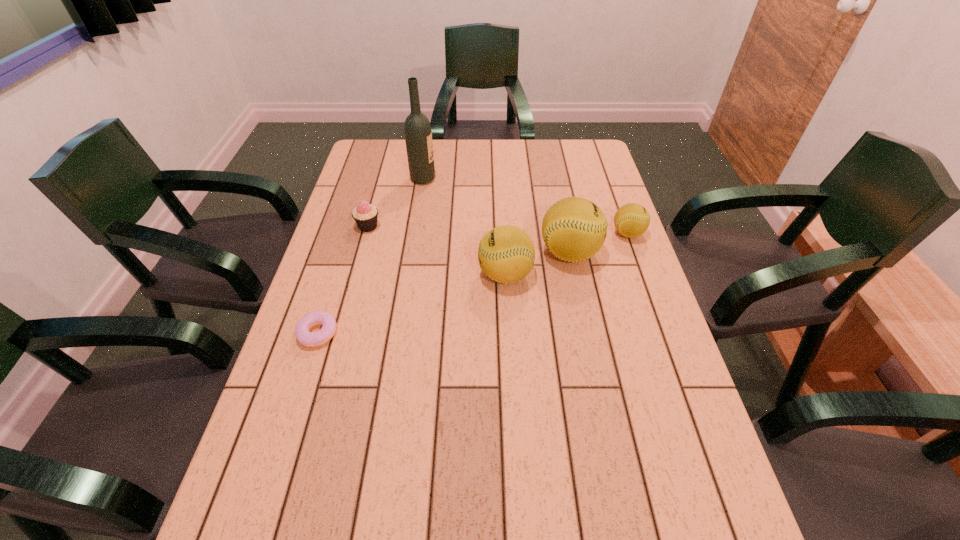
Identify the location of the second tallest softball. (506, 254).

Locate an element on the screen. the leftmost softball is located at coordinates (506, 254).

Locate an element on the screen. The image size is (960, 540). the second softball from right to left is located at coordinates (574, 229).

At what (x,y) coordinates should I click in order to perform the action: click on the rightmost softball. Please return your answer as a coordinate pair (x, y). This screenshot has height=540, width=960. Looking at the image, I should click on (631, 220).

Identify the location of the rightmost object. (631, 220).

Find the location of a particular element. The image size is (960, 540). the farthest object is located at coordinates (418, 136).

You are a GUI agent. You are given a task and a screenshot of the screen. Output one action in this format:
    pyautogui.click(x=<x>, y=<y>)
    Task: Click on the tallest object
    Image resolution: width=960 pixels, height=540 pixels.
    Given the screenshot: What is the action you would take?
    pyautogui.click(x=418, y=136)

Locate an element on the screen. The image size is (960, 540). cupcake is located at coordinates (365, 215).

This screenshot has height=540, width=960. What are the coordinates of `doughnut` in the screenshot? It's located at (310, 339).

Locate an element on the screen. Image resolution: width=960 pixels, height=540 pixels. the shortest object is located at coordinates (x=310, y=339).